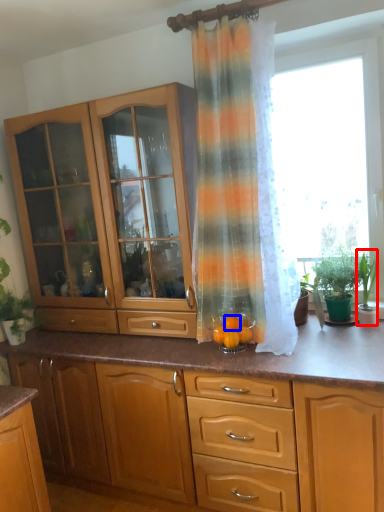
Question: Which object is further to the camera taking this photo, houseplant (highlighted by a red box) or orange (highlighted by a blue box)?

Choices:
 (A) houseplant
 (B) orange

Answer: (A)